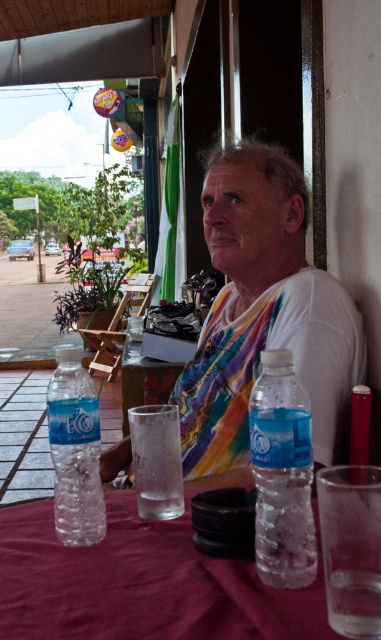
Between maroon fabric tablecloth at lower center and clear plastic bottle at lower center, which one has less height?

Standing shorter between the two is maroon fabric tablecloth at lower center.

Between point (158, 577) and point (291, 369), which one is positioned behind?

The point (291, 369) is more distant.

Does point (6, 611) lie in front of point (275, 456)?

That is True.

The width and height of the screenshot is (381, 640). Identify the location of maroon fabric tablecloth at lower center. (142, 582).

Is clear glass water at center positioned behind clear glass at center?

No, it is in front of clear glass at center.

Measure the distance between point (x=150, y=445) and camera.

They are 87.36 centimeters apart.

Locate an element on the screen. The width and height of the screenshot is (381, 640). clear glass water at center is located at coordinates (156, 461).

Can you confirm if clear plastic bottle at lower center is positioned to the left of clear glass at center?

Incorrect, clear plastic bottle at lower center is not on the left side of clear glass at center.

Is clear plastic bottle at lower center below clear glass at center?

Incorrect, clear plastic bottle at lower center is not positioned below clear glass at center.

Does point (265, 353) lie behind point (166, 397)?

No, it is not.

Image resolution: width=381 pixels, height=640 pixels. In order to click on clear plastic bottle at lower center in this screenshot , I will do `click(281, 474)`.